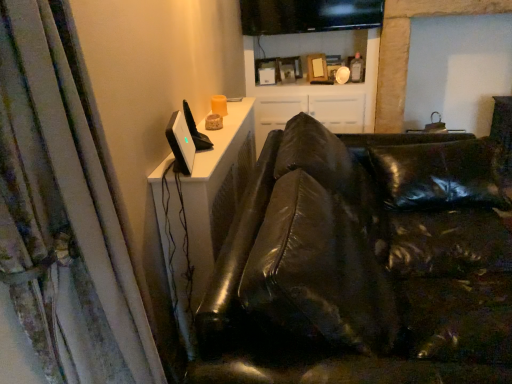
Question: Should I look upward or downward to see white glossy cabinet at upper center?

Choices:
 (A) up
 (B) down

Answer: (A)

Question: Can you confirm if white textured curtain at left is taller than white glossy cabinet at upper center?

Choices:
 (A) yes
 (B) no

Answer: (B)

Question: Is white textured curtain at left to the right of white glossy cabinet at upper center from the viewer's perspective?

Choices:
 (A) yes
 (B) no

Answer: (B)

Question: From a real-world perspective, is white textured curtain at left positioned under white glossy cabinet at upper center based on gravity?

Choices:
 (A) no
 (B) yes

Answer: (A)

Question: Considering the relative sizes of white textured curtain at left and white glossy cabinet at upper center in the image provided, is white textured curtain at left smaller than white glossy cabinet at upper center?

Choices:
 (A) no
 (B) yes

Answer: (B)

Question: Does white textured curtain at left touch white glossy cabinet at upper center?

Choices:
 (A) no
 (B) yes

Answer: (A)

Question: Would you say white textured curtain at left contains white glossy cabinet at upper center?

Choices:
 (A) yes
 (B) no

Answer: (B)

Question: Is black glossy monitor at upper center, the second computer monitor positioned from the front, at the right side of satin black monitor at upper left, the first computer monitor when ordered from left to right?

Choices:
 (A) yes
 (B) no

Answer: (A)

Question: From a real-world perspective, is black glossy monitor at upper center, which is the first computer monitor from back to front, under satin black monitor at upper left, the first computer monitor when ordered from left to right?

Choices:
 (A) no
 (B) yes

Answer: (A)

Question: Can we say black glossy monitor at upper center, the first computer monitor positioned from the right, lies outside satin black monitor at upper left, positioned as the 1th computer monitor in front-to-back order?

Choices:
 (A) no
 (B) yes

Answer: (B)

Question: Considering the relative positions of black glossy monitor at upper center, the first computer monitor positioned from the right, and satin black monitor at upper left, the second computer monitor when ordered from back to front, in the image provided, is black glossy monitor at upper center, the first computer monitor positioned from the right, to the left of satin black monitor at upper left, the second computer monitor when ordered from back to front, from the viewer's perspective?

Choices:
 (A) yes
 (B) no

Answer: (B)

Question: Does black glossy monitor at upper center, the first computer monitor positioned from the right, have a larger size compared to satin black monitor at upper left, the first computer monitor when ordered from left to right?

Choices:
 (A) no
 (B) yes

Answer: (B)

Question: From the image's perspective, does black glossy monitor at upper center, the 2th computer monitor from the left, appear higher than satin black monitor at upper left, positioned as the 1th computer monitor in front-to-back order?

Choices:
 (A) no
 (B) yes

Answer: (B)

Question: Considering the relative sizes of satin black monitor at upper left, positioned as the 1th computer monitor in front-to-back order, and white textured curtain at left in the image provided, is satin black monitor at upper left, positioned as the 1th computer monitor in front-to-back order, shorter than white textured curtain at left?

Choices:
 (A) no
 (B) yes

Answer: (B)